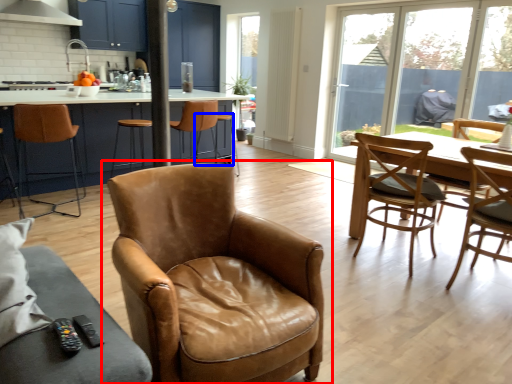
Question: Which object is further to the camera taking this photo, chair (highlighted by a red box) or bar stool (highlighted by a blue box)?

Choices:
 (A) chair
 (B) bar stool

Answer: (B)